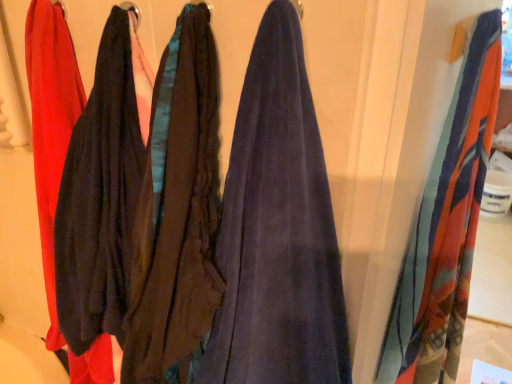
What do you see at coordinates (102, 192) in the screenshot?
I see `matte black fabric at left` at bounding box center [102, 192].

In order to face matte black fabric at left, should I rotate leftwards or rightwards?

To face it directly, rotate left by 25.575 degrees.

Measure the distance between matte black fabric at left and camera.

A distance of 24.15 inches exists between matte black fabric at left and camera.

Find the location of a particular element. matte black fabric at left is located at coordinates (102, 192).

What do you see at coordinates (446, 226) in the screenshot? I see `printed silk scarf at right` at bounding box center [446, 226].

I want to click on printed silk scarf at right, so click(x=446, y=226).

I want to click on matte black fabric at left, so (x=102, y=192).

Is printed silk scarf at right at the right side of matte black fabric at left?

Yes.

Which is behind, printed silk scarf at right or matte black fabric at left?

printed silk scarf at right is more distant.

Considering the positions of point (472, 40) and point (93, 302), is point (472, 40) closer or farther from the camera than point (93, 302)?

Point (472, 40).

From the image's perspective, which object appears higher, printed silk scarf at right or matte black fabric at left?

matte black fabric at left.

From a real-world perspective, which is physically below, printed silk scarf at right or matte black fabric at left?

In real-world perspective, printed silk scarf at right is lower.

Consider the image. Looking at their sizes, would you say printed silk scarf at right is wider or thinner than matte black fabric at left?

printed silk scarf at right is thinner than matte black fabric at left.

Consider the image. Who is taller, printed silk scarf at right or matte black fabric at left?

printed silk scarf at right.

Can you confirm if printed silk scarf at right is smaller than matte black fabric at left?

Incorrect, printed silk scarf at right is not smaller in size than matte black fabric at left.

Is printed silk scarf at right not inside matte black fabric at left?

Yes, printed silk scarf at right is outside of matte black fabric at left.

Are printed silk scarf at right and matte black fabric at left located far from each other?

No, printed silk scarf at right is in close proximity to matte black fabric at left.

Is printed silk scarf at right positioned with its back to matte black fabric at left?

printed silk scarf at right is not turned away from matte black fabric at left.

Locate an element on the screen. This screenshot has width=512, height=384. towel below the matte black fabric at left (from a real-world perspective) is located at coordinates (446, 226).

Is matte black fabric at left to the left of printed silk scarf at right from the viewer's perspective?

Correct, you'll find matte black fabric at left to the left of printed silk scarf at right.

Relative to printed silk scarf at right, is matte black fabric at left in front or behind?

Clearly, matte black fabric at left is in front of printed silk scarf at right.

Which is farther from the camera, (141, 117) or (446, 338)?

Point (446, 338)

From the image's perspective, which one is positioned higher, matte black fabric at left or printed silk scarf at right?

matte black fabric at left is shown above in the image.

From the picture: From a real-world perspective, which object rests below the other?

printed silk scarf at right is physically lower.

In terms of width, does matte black fabric at left look wider or thinner when compared to printed silk scarf at right?

Considering their sizes, matte black fabric at left looks broader than printed silk scarf at right.

Is matte black fabric at left shorter than printed silk scarf at right?

Yes.

Is matte black fabric at left bigger or smaller than printed silk scarf at right?

In the image, matte black fabric at left appears to be smaller than printed silk scarf at right.

Would you say matte black fabric at left is outside printed silk scarf at right?

matte black fabric at left lies outside printed silk scarf at right's area.

Is matte black fabric at left positioned far away from printed silk scarf at right?

No, matte black fabric at left is not far from printed silk scarf at right.

Is matte black fabric at left aimed at printed silk scarf at right?

No.

How different are the orientations of matte black fabric at left and printed silk scarf at right in degrees?

The angle between the facing direction of matte black fabric at left and the facing direction of printed silk scarf at right is 76 degrees.

At what (x,y) coordinates should I click in order to perform the action: click on towel below the matte black fabric at left (from a real-world perspective). Please return your answer as a coordinate pair (x, y). This screenshot has width=512, height=384. Looking at the image, I should click on (446, 226).

This screenshot has height=384, width=512. In order to click on clothing lying on the left of printed silk scarf at right in this screenshot , I will do `click(102, 192)`.

Identify the location of towel directly beneath the matte black fabric at left (from a real-world perspective). The image size is (512, 384). (446, 226).